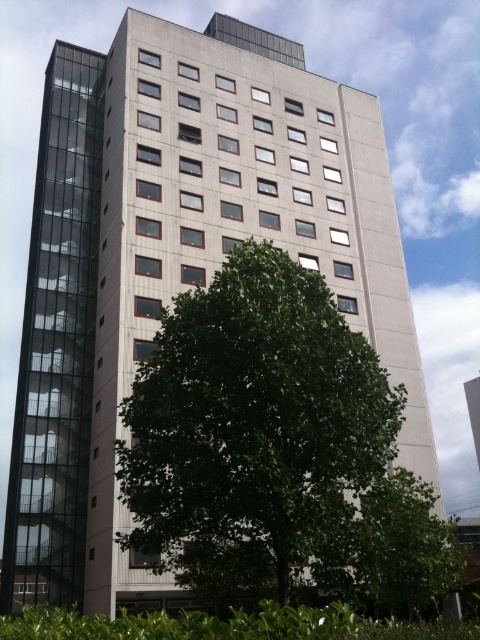
Question: Can you confirm if green leafy tree at center is smaller than green leafy hedge at lower center?

Choices:
 (A) yes
 (B) no

Answer: (A)

Question: Is green leafy tree at center thinner than green leafy hedge at lower center?

Choices:
 (A) yes
 (B) no

Answer: (A)

Question: Can you confirm if green leafy tree at center is wider than green leafy hedge at lower center?

Choices:
 (A) no
 (B) yes

Answer: (A)